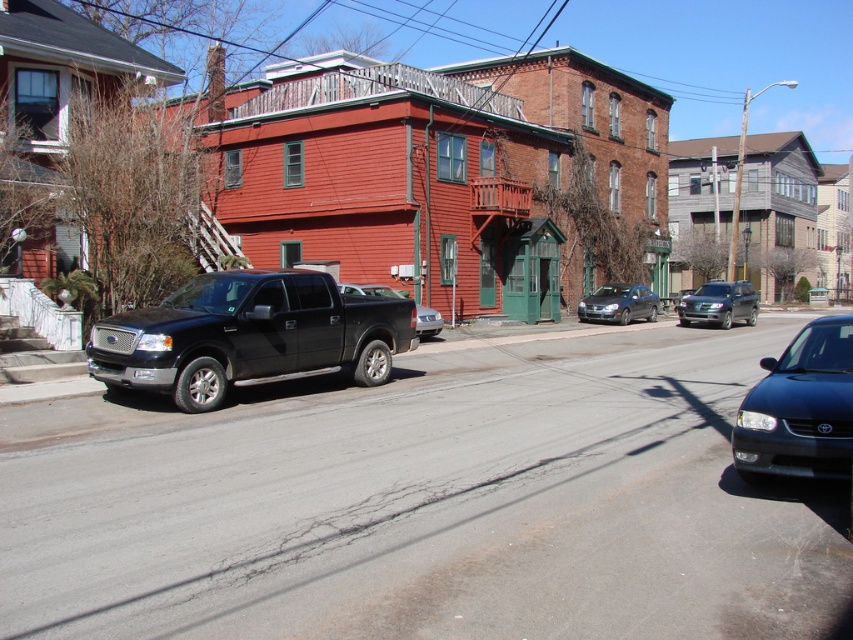
What do you see at coordinates (619, 304) in the screenshot? I see `satin silver sedan at center` at bounding box center [619, 304].

Does satin silver sedan at center lie in front of metallic silver sedan at center?

That is False.

Which is behind, point (634, 305) or point (419, 312)?

The point (634, 305) is behind.

Find the location of a particular element. satin silver sedan at center is located at coordinates (619, 304).

Consider the image. Can you confirm if satin black sedan at lower right is positioned to the right of metallic gray suv at center?

Incorrect, satin black sedan at lower right is not on the right side of metallic gray suv at center.

In the scene shown: Between satin black sedan at lower right and metallic gray suv at center, which one is positioned lower?

satin black sedan at lower right is lower down.

Where is `satin black sedan at lower right`? This screenshot has height=640, width=853. satin black sedan at lower right is located at coordinates [x=799, y=406].

This screenshot has height=640, width=853. In order to click on satin black sedan at lower right in this screenshot , I will do `click(799, 406)`.

Is satin black sedan at lower right above satin silver sedan at center?

Actually, satin black sedan at lower right is below satin silver sedan at center.

Between point (846, 385) and point (648, 312), which one is positioned in front?

Point (846, 385) is in front.

At what (x,y) coordinates should I click in order to perform the action: click on satin black sedan at lower right. Please return your answer as a coordinate pair (x, y). The height and width of the screenshot is (640, 853). Looking at the image, I should click on (799, 406).